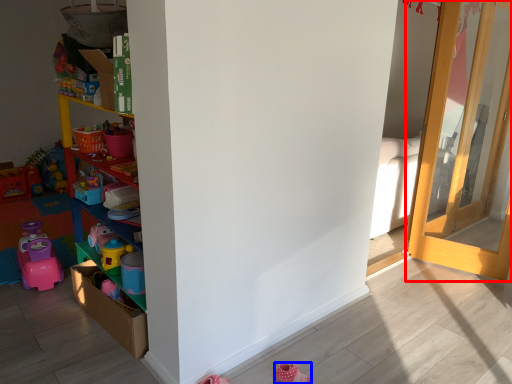
Question: Which point is further to the camera, door (highlighted by a red box) or shoe (highlighted by a blue box)?

Choices:
 (A) door
 (B) shoe

Answer: (A)